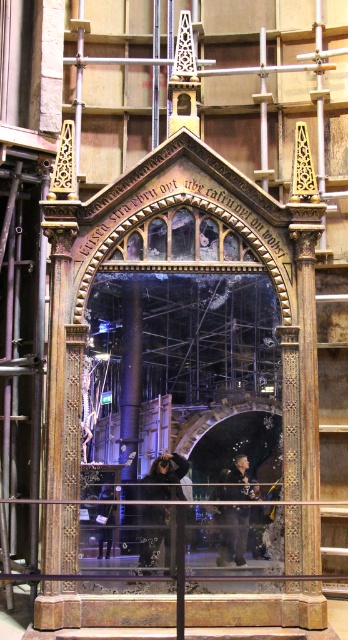
You are an actor preparing to walk through the archway in the scene. You see a black fabric construction worker at center and a black leather jacket at lower center. Which object takes up more space in the image?

The black leather jacket at lower center takes up more space in the image because the black fabric construction worker at center occupies less space than it.